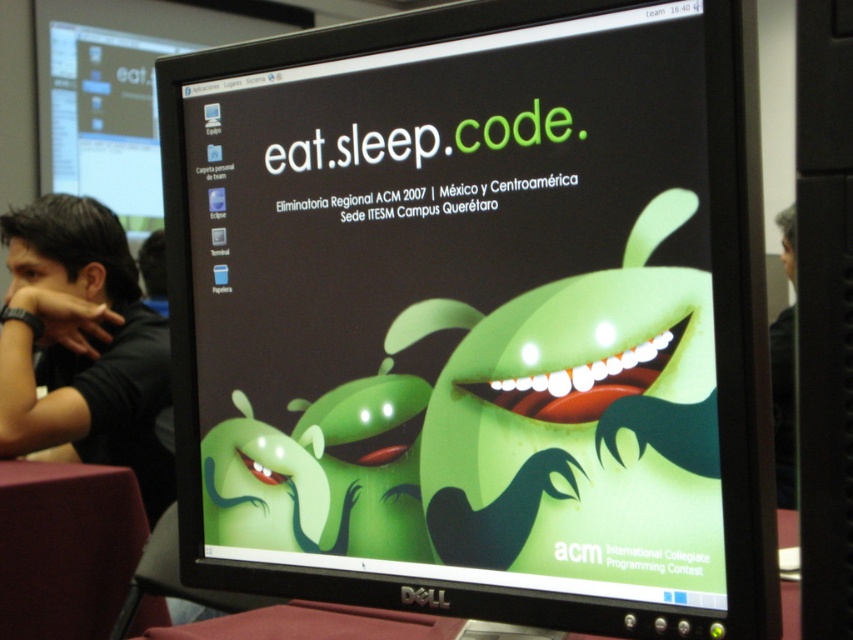
Does green matte screen at center come behind black shirt at left?

No, it is not.

Does green matte screen at center have a larger size compared to black shirt at left?

No.

Does point (532, 388) come in front of point (132, 438)?

Yes, it is.

Find the location of a particular element. green matte screen at center is located at coordinates (477, 316).

Between black shirt at left and maroon fabric table at lower left, which one appears on the left side from the viewer's perspective?

black shirt at left is more to the left.

Is black shirt at left positioned before maroon fabric table at lower left?

No.

Describe the element at coordinates (84, 346) in the screenshot. I see `black shirt at left` at that location.

Locate an element on the screen. This screenshot has width=853, height=640. black shirt at left is located at coordinates (84, 346).

Between point (763, 580) and point (39, 529), which one is positioned in front?

Point (763, 580) is more forward.

Is point (495, 244) less distant than point (24, 561)?

Yes, it is.

You are a GUI agent. You are given a task and a screenshot of the screen. Output one action in this format:
    pyautogui.click(x=<x>, y=<y>)
    Task: Click on the green matte screen at center
    The height and width of the screenshot is (640, 853).
    Given the screenshot: What is the action you would take?
    pyautogui.click(x=477, y=316)